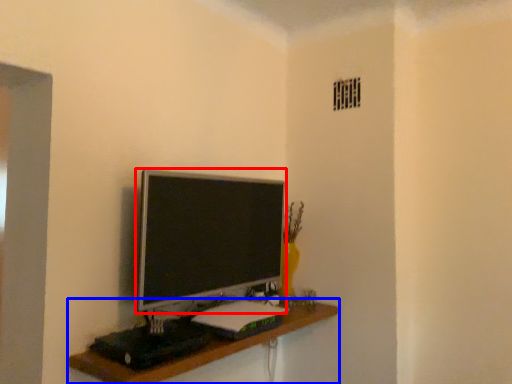
Question: Which object appears farthest to the camera in this image, television (highlighted by a red box) or shelf (highlighted by a blue box)?

Choices:
 (A) television
 (B) shelf

Answer: (A)